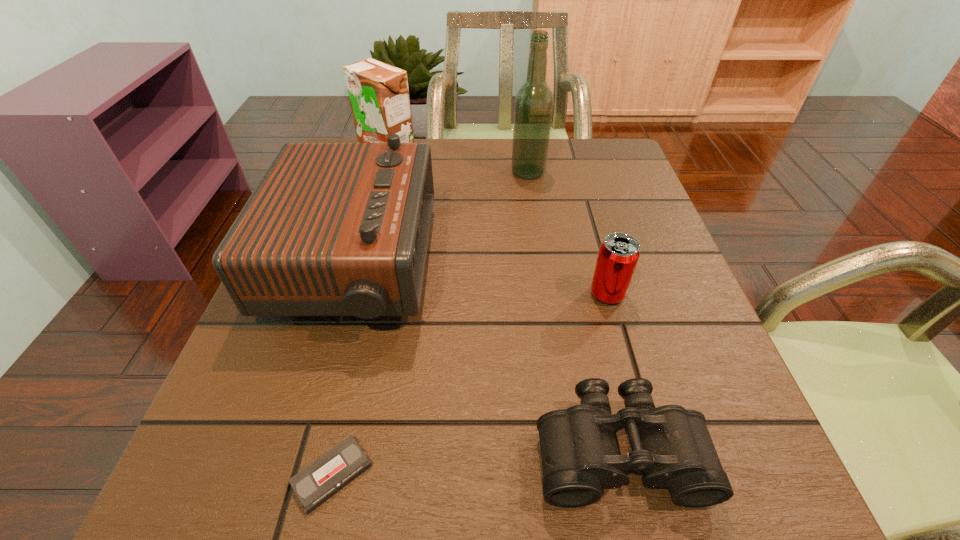
You are a GUI agent. You are given a task and a screenshot of the screen. Output one action in this format:
    pyautogui.click(x=<x>, y=<y>)
    Task: Click on the free spot between the radio receiver and the shortest object
    The image size is (960, 540).
    Given the screenshot: What is the action you would take?
    pyautogui.click(x=343, y=370)

Find the location of a particular element. unoccupied area between the videotape and the liquor is located at coordinates (430, 323).

The width and height of the screenshot is (960, 540). Find the location of `free space between the fifth tallest object and the shortest object`. free space between the fifth tallest object and the shortest object is located at coordinates (475, 463).

I want to click on vacant space in between the tallest object and the carton, so click(458, 165).

Locate an element on the screen. The image size is (960, 540). free space between the tallest object and the fifth tallest object is located at coordinates point(573,311).

Locate which object is the fifth closest to the radio receiver. Please provide its 2D coordinates. Your answer should be formatted as a tuple, i.e. [(x, y)], where the tuple contains the x and y coordinates of a point satisfying the conditions above.

[(618, 255)]

Point out which object is positioned as the fifth nearest to the binoculars. Please provide its 2D coordinates. Your answer should be formatted as a tuple, i.e. [(x, y)], where the tuple contains the x and y coordinates of a point satisfying the conditions above.

[(379, 97)]

You are a GUI agent. You are given a task and a screenshot of the screen. Output one action in this format:
    pyautogui.click(x=<x>, y=<y>)
    Task: Click on the vacant position in the image that satisfies the following two spatial constraints: 1. on the straw side of the shortest object; 2. on the right side of the carton
    
    Given the screenshot: What is the action you would take?
    pyautogui.click(x=296, y=475)

Where is `blank area in the image that satisfies the following two spatial constraints: 1. on the straw side of the soda can; 2. on the left side of the carton`? The height and width of the screenshot is (540, 960). blank area in the image that satisfies the following two spatial constraints: 1. on the straw side of the soda can; 2. on the left side of the carton is located at coordinates (348, 294).

This screenshot has width=960, height=540. What are the coordinates of `vacant space that satisfies the following two spatial constraints: 1. on the straw side of the carton; 2. on the right side of the tallest object` in the screenshot? It's located at (383, 172).